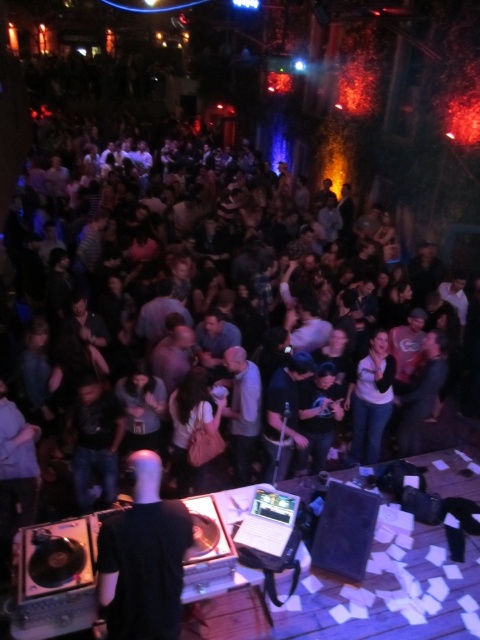
Is black matte shirt at center behind light gray shirt at center?

No, black matte shirt at center is in front of light gray shirt at center.

Does point (147, 531) come behind point (230, 417)?

No, it is not.

Is point (175, 500) positioned after point (240, 362)?

No.

In order to click on black matte shirt at center in this screenshot , I will do `click(144, 557)`.

Can you confirm if black matte shirt at center is bigger than white matte shirt at center?

No, black matte shirt at center is not bigger than white matte shirt at center.

Does point (103, 522) come closer to viewer compared to point (350, 442)?

Yes.

Locate an element on the screen. The height and width of the screenshot is (640, 480). black matte shirt at center is located at coordinates (144, 557).

Which is above, white matte shirt at center or light gray shirt at center?

white matte shirt at center

From the picture: Is white matte shirt at center shorter than light gray shirt at center?

In fact, white matte shirt at center may be taller than light gray shirt at center.

Identify the location of white matte shirt at center. This screenshot has width=480, height=640. (371, 400).

Locate an element on the screen. Image resolution: width=480 pixels, height=640 pixels. white matte shirt at center is located at coordinates (371, 400).